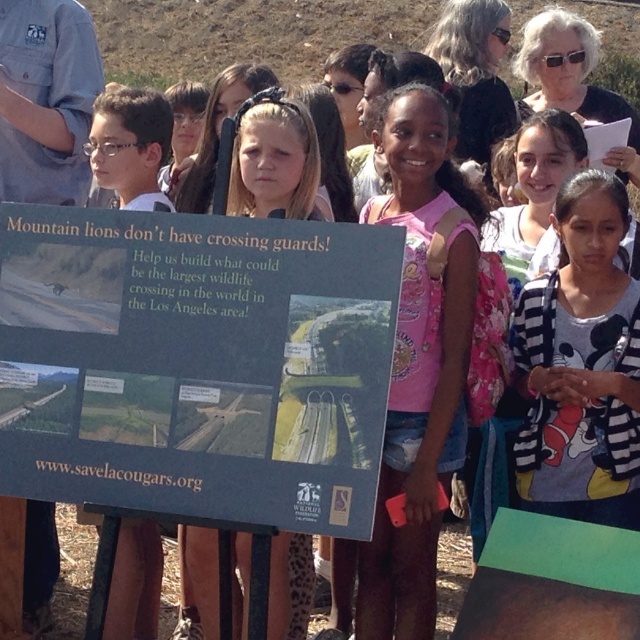
You are a photographer trying to capture a clear photo of both the pink fabric shirt at center and the white striped sweater at center. Since you want both subjects to be in focus, you need to adjust your camera settings. Which subject is closer to you, requiring you to focus on that first to ensure depth of field?

The pink fabric shirt at center is closer to the viewer than the white striped sweater at center, so you should focus on the pink fabric shirt at center first to ensure both are in focus.

What is the object located at the coordinates point (196, 364) in the image?

The point (196, 364) marks the blue cardboard sign at center.

You are a photographer positioned in front of the blue cardboard sign at center and the white striped sweater at center. Which object will appear larger in your photo?

The blue cardboard sign at center will appear larger in the photo because it is closer to the viewer than the white striped sweater at center.